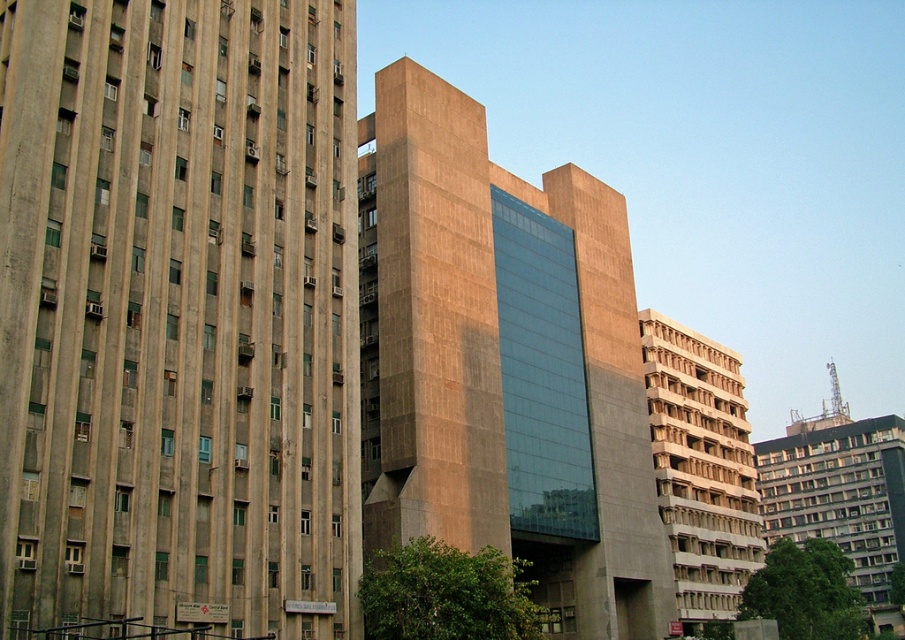
Question: Which point appears closest to the camera in this image?

Choices:
 (A) (661, 378)
 (B) (118, 525)
 (C) (653, 588)

Answer: (B)

Question: Is concrete building at left above matte concrete building at center?

Choices:
 (A) yes
 (B) no

Answer: (A)

Question: Considering the relative positions of matte concrete building at center and white textured building at center in the image provided, where is matte concrete building at center located with respect to white textured building at center?

Choices:
 (A) below
 (B) above

Answer: (B)

Question: Among these points, which one is nearest to the camera?

Choices:
 (A) (691, 577)
 (B) (102, 552)
 (C) (427, 410)

Answer: (B)

Question: Does concrete building at left appear over matte concrete building at center?

Choices:
 (A) no
 (B) yes

Answer: (B)

Question: Estimate the real-world distances between objects in this image. Which object is farther from the concrete building at left?

Choices:
 (A) matte concrete building at center
 (B) white textured building at center

Answer: (B)